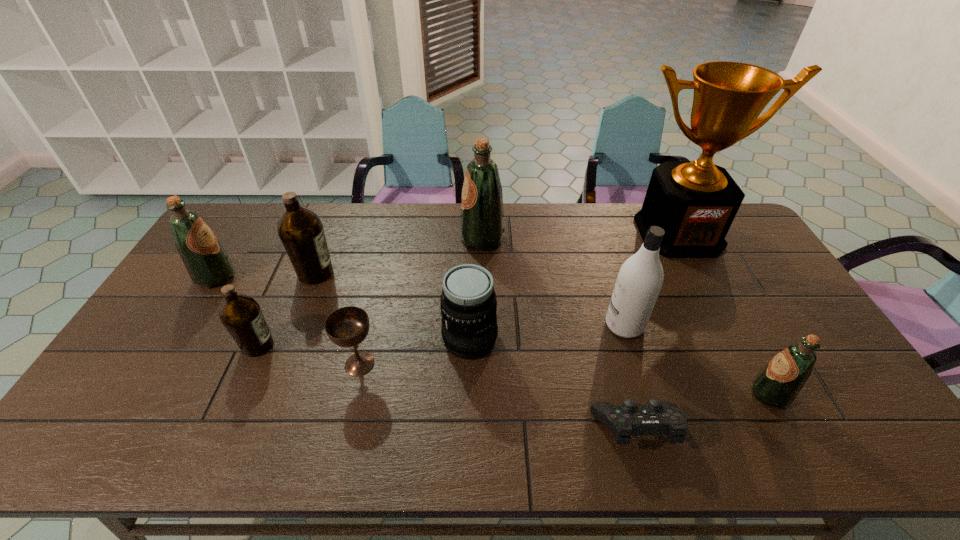
In the image, there is a desktop. Where is `free space at the far left corner`? free space at the far left corner is located at coordinates (219, 239).

Locate an element on the screen. vacant area between the rightmost green olive oil and the smaller brown olive oil is located at coordinates (514, 370).

Image resolution: width=960 pixels, height=540 pixels. I want to click on vacant area that lies between the second farthest green olive oil and the shampoo, so click(x=420, y=301).

Where is `empty space that is in between the leftmost object and the farther brown olive oil`? empty space that is in between the leftmost object and the farther brown olive oil is located at coordinates (266, 275).

Image resolution: width=960 pixels, height=540 pixels. What are the coordinates of `free area in between the farthest olive oil and the farther brown olive oil` in the screenshot? It's located at (398, 256).

This screenshot has height=540, width=960. I want to click on vacant point located between the farther brown olive oil and the second nearest green olive oil, so click(266, 275).

Locate an element on the screen. This screenshot has height=540, width=960. unoccupied area between the rightmost olive oil and the telephoto lens is located at coordinates (619, 367).

The width and height of the screenshot is (960, 540). I want to click on unoccupied position between the farther brown olive oil and the trophy cup, so click(497, 253).

Locate an element on the screen. The height and width of the screenshot is (540, 960). object that is the sixth closest to the second smallest green olive oil is located at coordinates (656, 417).

Select which object appears as the fifth closest to the farther brown olive oil. Please provide its 2D coordinates. Your answer should be formatted as a tuple, i.e. [(x, y)], where the tuple contains the x and y coordinates of a point satisfying the conditions above.

[(482, 217)]